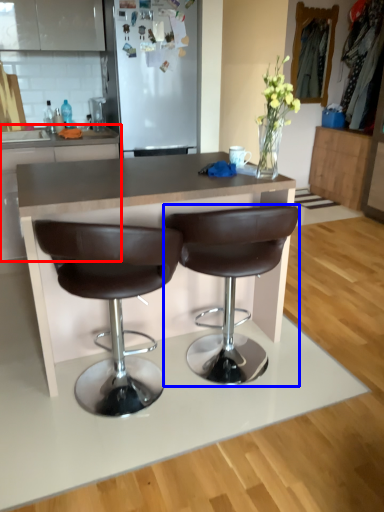
Question: Among these objects, which one is farthest to the camera, cabinetry (highlighted by a red box) or chair (highlighted by a blue box)?

Choices:
 (A) cabinetry
 (B) chair

Answer: (A)